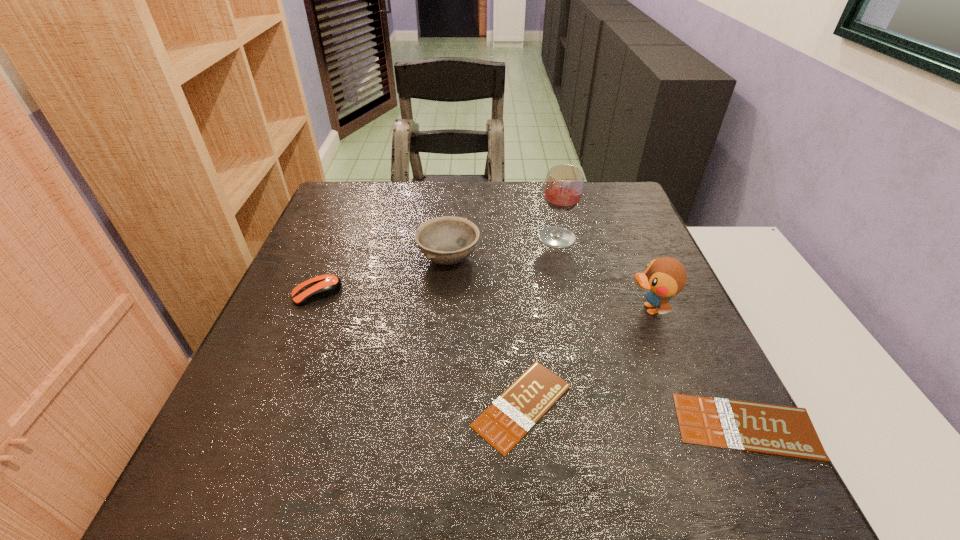
Find the location of a particular element. This screenshot has width=960, height=540. free space located 0.310m on the left of the right chocolate bar is located at coordinates (495, 426).

You are a GUI agent. You are given a task and a screenshot of the screen. Output one action in this format:
    pyautogui.click(x=<x>, y=<y>)
    Task: Click on the free space located on the left of the wineglass
    Image resolution: width=960 pixels, height=540 pixels.
    Given the screenshot: What is the action you would take?
    pyautogui.click(x=447, y=238)

The width and height of the screenshot is (960, 540). Find the location of `vacant area situated 0.190m on the front of the third shortest object`. vacant area situated 0.190m on the front of the third shortest object is located at coordinates (282, 378).

Locate an element on the screen. The width and height of the screenshot is (960, 540). vacant space located 0.200m on the left of the bowl is located at coordinates (337, 258).

The height and width of the screenshot is (540, 960). Identify the location of vacant space located 0.120m on the front-facing side of the second tallest object. (571, 309).

You are a GUI agent. You are given a task and a screenshot of the screen. Output one action in this format:
    pyautogui.click(x=<x>, y=<y>)
    Task: Click on the free space located on the front-facing side of the second tallest object
    
    Given the screenshot: What is the action you would take?
    pyautogui.click(x=444, y=309)

Where is `vacant area located on the front-facing side of the second tallest object`? The image size is (960, 540). vacant area located on the front-facing side of the second tallest object is located at coordinates (558, 309).

Locate an element on the screen. object present at the left edge is located at coordinates (323, 286).

Image resolution: width=960 pixels, height=540 pixels. In order to click on chocolate bar located in the right edge section of the desktop in this screenshot , I will do `click(786, 431)`.

The image size is (960, 540). In order to click on duck located at the right edge in this screenshot , I will do `click(664, 277)`.